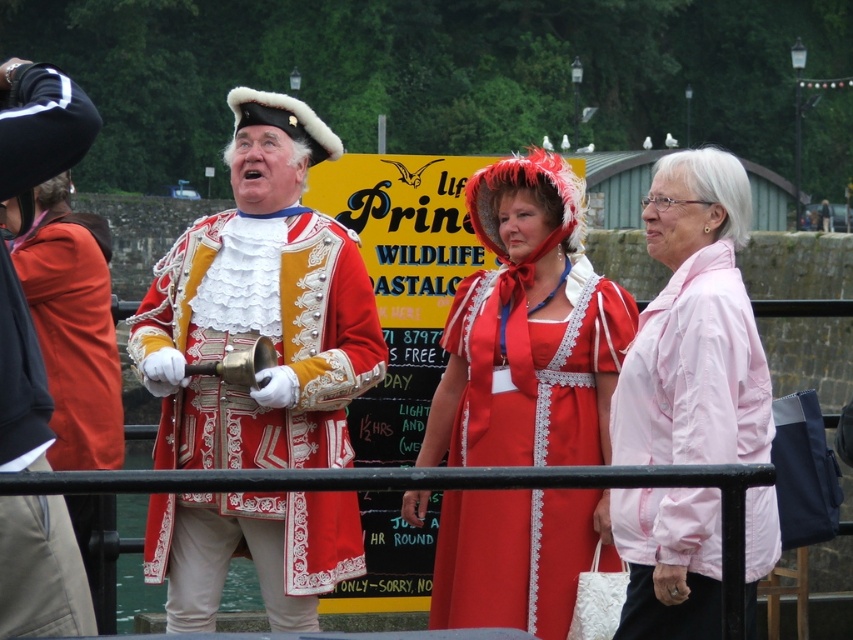
Can you confirm if matte gold jacket at center is thinner than white silky wig at upper right?

Correct, matte gold jacket at center's width is less than white silky wig at upper right's.

Does point (41, 161) lie behind point (750, 196)?

No, (41, 161) is in front of (750, 196).

Locate an element on the screen. This screenshot has height=640, width=853. matte gold jacket at center is located at coordinates (39, 570).

Is white silky wig at upper right wider than brown fuzzy wig at upper left?

Correct, the width of white silky wig at upper right exceeds that of brown fuzzy wig at upper left.

How distant is white silky wig at upper right from brown fuzzy wig at upper left?

white silky wig at upper right is 23.87 meters from brown fuzzy wig at upper left.

Describe the element at coordinates (712, 186) in the screenshot. I see `white silky wig at upper right` at that location.

I want to click on white silky wig at upper right, so click(712, 186).

Measure the distance between pink fabric jacket at right and camera.

They are 30.97 meters apart.

Who is positioned more to the right, pink fabric jacket at right or white silky wig at upper right?

Positioned to the right is white silky wig at upper right.

Locate an element on the screen. The width and height of the screenshot is (853, 640). pink fabric jacket at right is located at coordinates (694, 326).